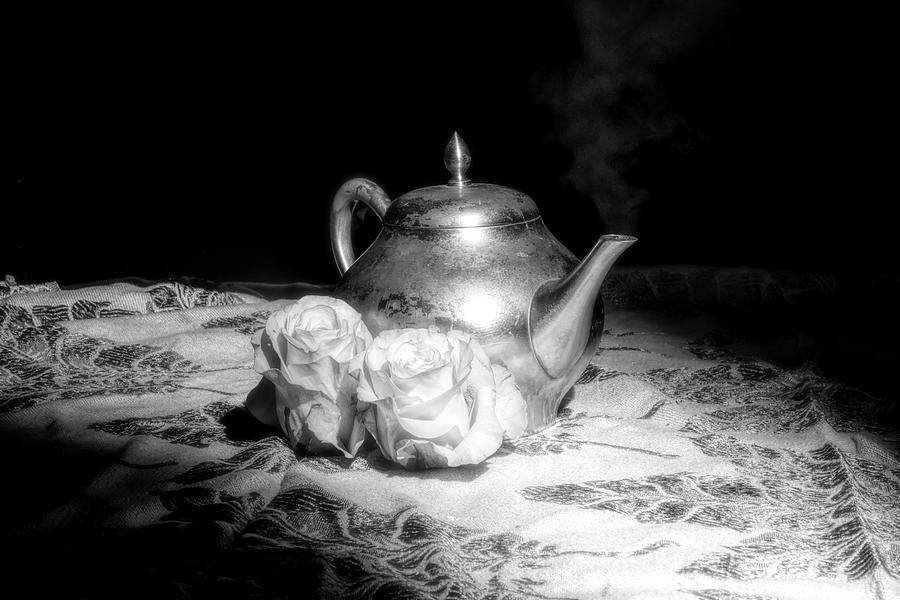
Locate an element on the screen. The height and width of the screenshot is (600, 900). handle is located at coordinates (339, 218).